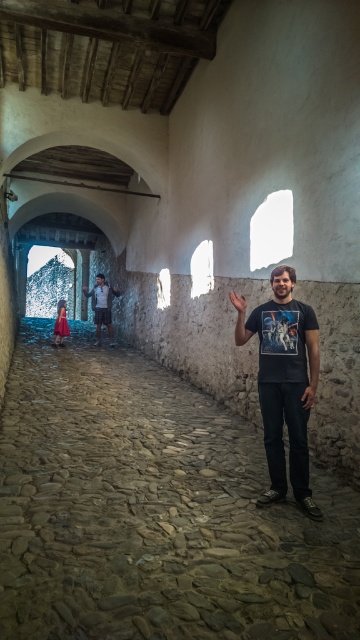
Is point (109, 314) less distant than point (62, 324)?

No, (109, 314) is further to viewer.

Who is positioned more to the left, light blue denim shorts at center or matte red dress at far left?

Positioned to the left is matte red dress at far left.

Who is more distant from viewer, (105,285) or (61,326)?

The point (105,285) is more distant.

Find the location of a particular element. The height and width of the screenshot is (640, 360). light blue denim shorts at center is located at coordinates (101, 305).

Consider the image. Does smooth stone floor at center have a lesser height compared to matte red dress at far left?

Yes.

The image size is (360, 640). Describe the element at coordinates (154, 509) in the screenshot. I see `smooth stone floor at center` at that location.

What are the coordinates of `smooth stone floor at center` in the screenshot? It's located at (154, 509).

Image resolution: width=360 pixels, height=640 pixels. What are the coordinates of `smooth stone floor at center` in the screenshot? It's located at (154, 509).

Which is in front, point (253, 317) or point (61, 336)?

Positioned in front is point (253, 317).

Who is shorter, black matte t-shirt at center or matte red dress at far left?

With less height is matte red dress at far left.

At what (x,y) coordinates should I click in order to perform the action: click on black matte t-shirt at center. Please return your answer as a coordinate pair (x, y). The width and height of the screenshot is (360, 640). Looking at the image, I should click on (284, 381).